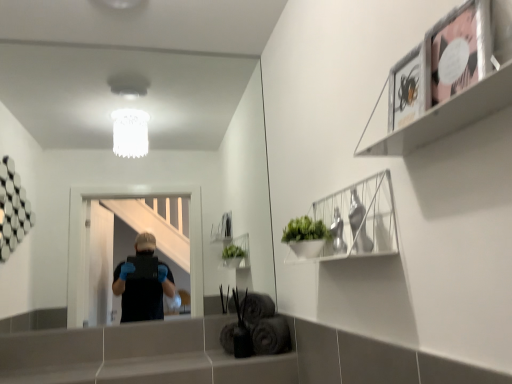
Question: Is metallic silver frame at upper right taller than white wire basket at upper right?

Choices:
 (A) yes
 (B) no

Answer: (A)

Question: Is metallic silver frame at upper right to the right of white wire basket at upper right from the viewer's perspective?

Choices:
 (A) no
 (B) yes

Answer: (B)

Question: Is metallic silver frame at upper right aimed at white wire basket at upper right?

Choices:
 (A) yes
 (B) no

Answer: (B)

Question: Is metallic silver frame at upper right next to white wire basket at upper right?

Choices:
 (A) no
 (B) yes

Answer: (A)

Question: Is metallic silver frame at upper right positioned behind white wire basket at upper right?

Choices:
 (A) no
 (B) yes

Answer: (A)

Question: Does point (417, 67) appear closer or farther from the camera than point (25, 367)?

Choices:
 (A) farther
 (B) closer

Answer: (B)

Question: From the image's perspective, relative to smooth gray ledge at lower center, is matte black picture frame at upper right above or below?

Choices:
 (A) above
 (B) below

Answer: (A)

Question: Is matte black picture frame at upper right taller or shorter than smooth gray ledge at lower center?

Choices:
 (A) tall
 (B) short

Answer: (A)

Question: In terms of width, does matte black picture frame at upper right look wider or thinner when compared to smooth gray ledge at lower center?

Choices:
 (A) thin
 (B) wide

Answer: (A)

Question: Considering their positions, is metallic silver frame at upper right located in front of or behind matte black picture frame at upper right?

Choices:
 (A) front
 (B) behind

Answer: (A)

Question: In terms of width, does metallic silver frame at upper right look wider or thinner when compared to matte black picture frame at upper right?

Choices:
 (A) wide
 (B) thin

Answer: (A)

Question: From a real-world perspective, is metallic silver frame at upper right physically located above or below matte black picture frame at upper right?

Choices:
 (A) above
 (B) below

Answer: (A)

Question: From the image's perspective, is metallic silver frame at upper right located above or below matte black picture frame at upper right?

Choices:
 (A) below
 (B) above

Answer: (B)

Question: From a real-world perspective, is smooth gray ledge at lower center positioned above or below matte black picture frame at upper right?

Choices:
 (A) above
 (B) below

Answer: (B)

Question: Is smooth gray ledge at lower center bigger or smaller than matte black picture frame at upper right?

Choices:
 (A) small
 (B) big

Answer: (B)